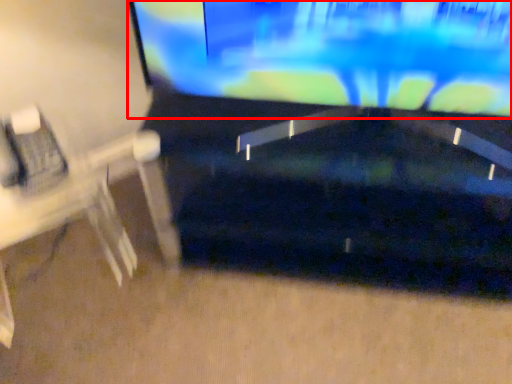
Question: From the image, what is the correct spatial relationship of television (annotated by the red box) in relation to computer desk?

Choices:
 (A) right
 (B) left

Answer: (A)